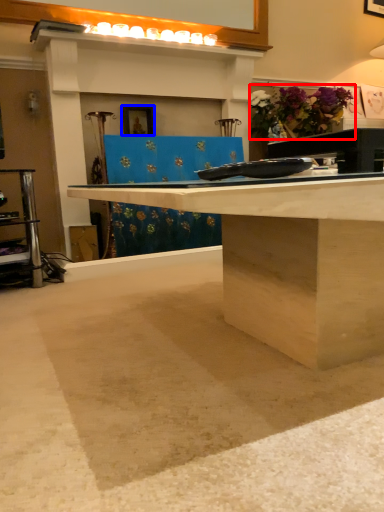
Question: Which point is closer to the camera, flower (highlighted by a red box) or picture frame (highlighted by a blue box)?

Choices:
 (A) flower
 (B) picture frame

Answer: (B)